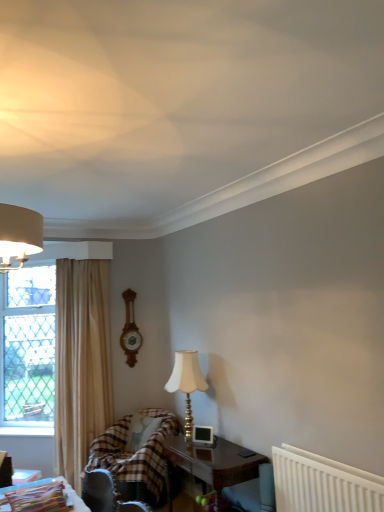
Question: Is point (134, 332) closer or farther from the camera than point (64, 349)?

Choices:
 (A) closer
 (B) farther

Answer: (B)

Question: Considering the positions of wooden clock at center and beige fabric curtain at left in the image, is wooden clock at center bigger or smaller than beige fabric curtain at left?

Choices:
 (A) big
 (B) small

Answer: (B)

Question: Considering the real-world distances, which object is farthest from the white plastic radiator at lower right?

Choices:
 (A) wooden clock at center
 (B) plaid fabric chair at lower left
 (C) beige fabric curtain at left
 (D) plastic magazine at lower left, which appears as the second table when ordered from the bottom
 (E) dark wood table at lower center, which is the second table in left-to-right order

Answer: (A)

Question: Which object is positioned closest to the wooden clock at center?

Choices:
 (A) clear glass window at left
 (B) plastic magazine at lower left, the 1th table positioned from the front
 (C) white plastic radiator at lower right
 (D) dark wood table at lower center, the second table viewed from the top
 (E) plaid fabric chair at lower left

Answer: (E)